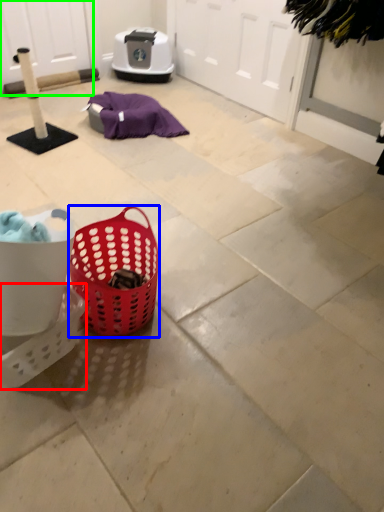
Question: Which object is positioned closest to basket (highlighted by a red box)? Select from picnic basket (highlighted by a blue box) and screen door (highlighted by a green box).

Choices:
 (A) picnic basket
 (B) screen door

Answer: (A)